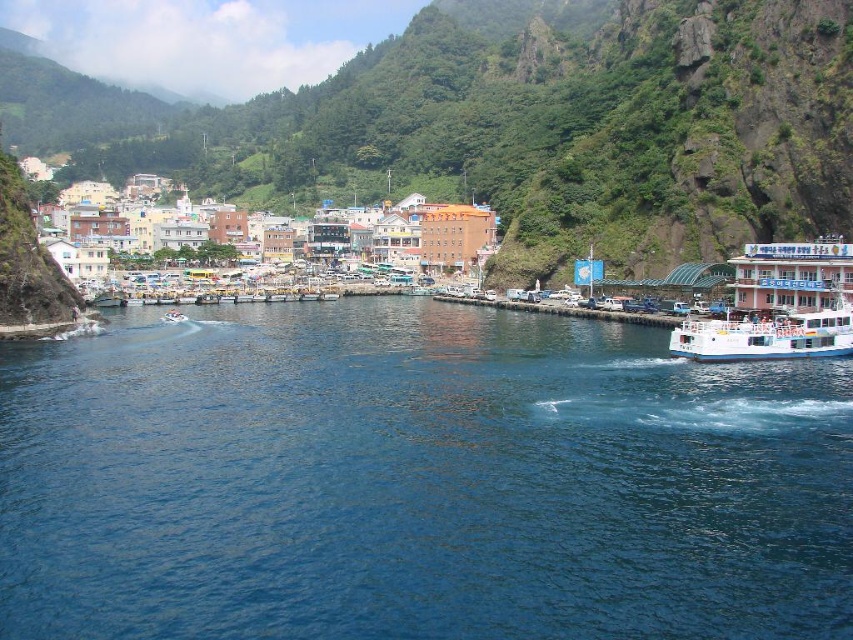
You are a sailor planning to dock your boat at the harbor pier. Based on the scene, will the white glossy boat at lower left be fully submerged in the blue liquid water at center when it approaches the pier?

The blue liquid water at center has a greater height compared to white glossy boat at lower left, meaning the water level is sufficient to keep the white glossy boat at lower left afloat and not submerged. Therefore, the boat will not be fully submerged when approaching the pier.

You are a photographer planning to capture the entire scene of the coastal town. You notice the blue liquid water at center and the white glossy boat at lower left. Which object should you focus on if you want to highlight the larger element in your photo?

The blue liquid water at center is larger in size than the white glossy boat at lower left, so focusing on the blue liquid water at center would highlight the larger element in the photo.